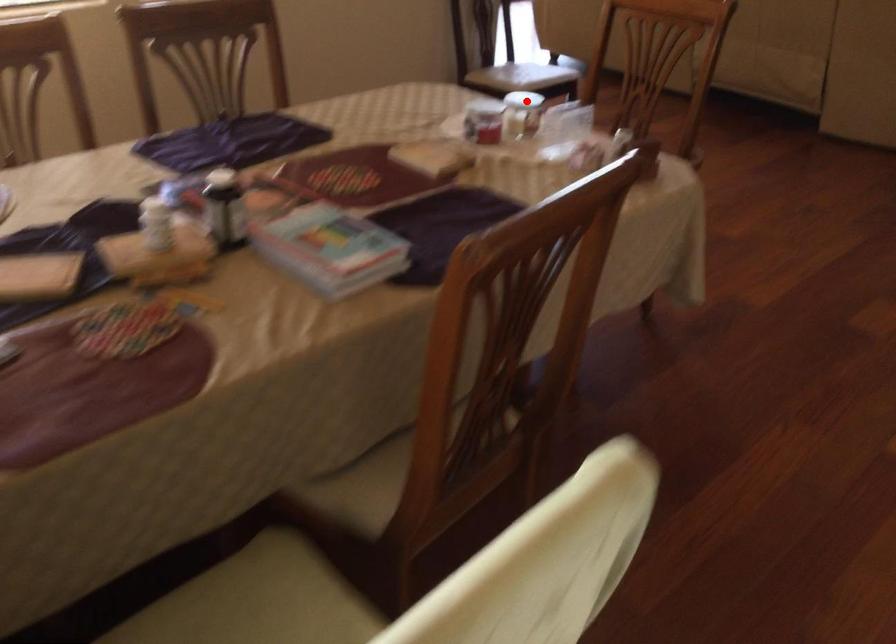
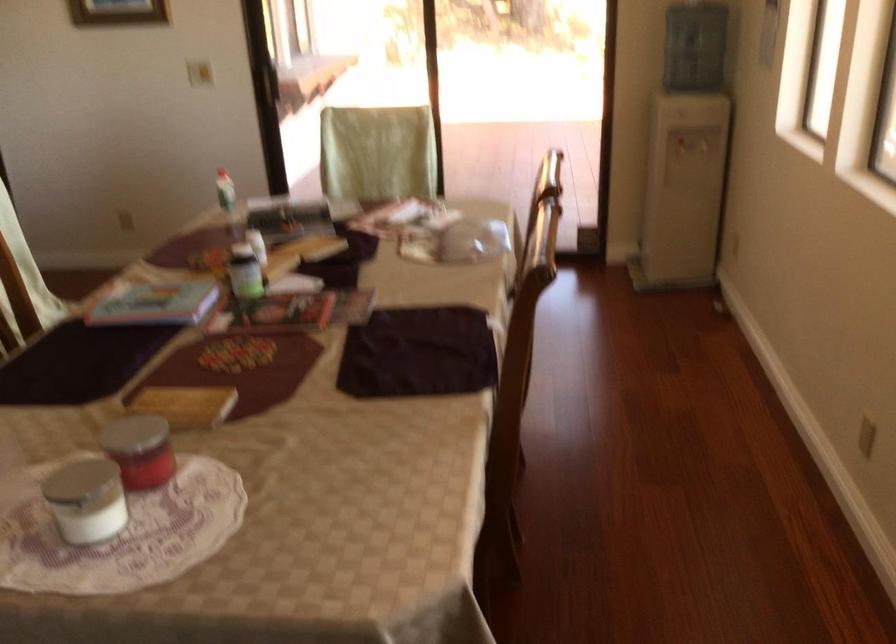
Question: I am providing you with two images of the same scene from different viewpoints. Image1 has a red point marked. In image2, the corresponding 3D location appears at what relative position? Reply with the corresponding letter.

Choices:
 (A) Closer
 (B) Farther

Answer: (A)